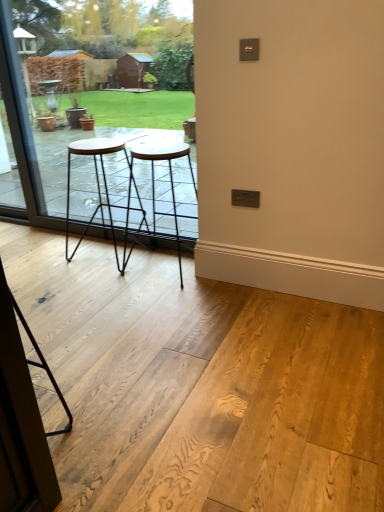
Question: Should I look upward or downward to see transparent glass screen door at lower left?

Choices:
 (A) up
 (B) down

Answer: (B)

Question: Should I look upward or downward to see transparent glass window at center?

Choices:
 (A) down
 (B) up

Answer: (B)

Question: Could you tell me if transparent glass screen door at lower left is facing transparent glass window at center?

Choices:
 (A) yes
 (B) no

Answer: (B)

Question: Is transparent glass screen door at lower left not inside transparent glass window at center?

Choices:
 (A) no
 (B) yes

Answer: (B)

Question: Considering the relative positions of transparent glass screen door at lower left and transparent glass window at center in the image provided, is transparent glass screen door at lower left behind transparent glass window at center?

Choices:
 (A) no
 (B) yes

Answer: (A)

Question: Would you say transparent glass window at center is part of transparent glass screen door at lower left's contents?

Choices:
 (A) yes
 (B) no

Answer: (B)

Question: From the image's perspective, is transparent glass screen door at lower left below transparent glass window at center?

Choices:
 (A) no
 (B) yes

Answer: (B)

Question: From the image's perspective, is transparent glass screen door at lower left over transparent glass window at center?

Choices:
 (A) yes
 (B) no

Answer: (B)

Question: From a real-world perspective, is black metal stool at center, the first stool when ordered from right to left, positioned over transparent glass window at center based on gravity?

Choices:
 (A) no
 (B) yes

Answer: (A)

Question: Does black metal stool at center, the first stool when ordered from right to left, have a lesser height compared to transparent glass window at center?

Choices:
 (A) yes
 (B) no

Answer: (A)

Question: Can you confirm if black metal stool at center, the first stool when ordered from right to left, is wider than transparent glass window at center?

Choices:
 (A) no
 (B) yes

Answer: (B)

Question: Is black metal stool at center, the first stool when ordered from right to left, thinner than transparent glass window at center?

Choices:
 (A) yes
 (B) no

Answer: (B)

Question: From the image's perspective, is black metal stool at center, the first stool when ordered from right to left, located beneath transparent glass window at center?

Choices:
 (A) no
 (B) yes

Answer: (B)

Question: Is black metal stool at center, the first stool when ordered from right to left, facing away from transparent glass window at center?

Choices:
 (A) yes
 (B) no

Answer: (A)

Question: Can you confirm if black metal stool at center, the first stool when ordered from right to left, is smaller than transparent glass screen door at lower left?

Choices:
 (A) no
 (B) yes

Answer: (A)